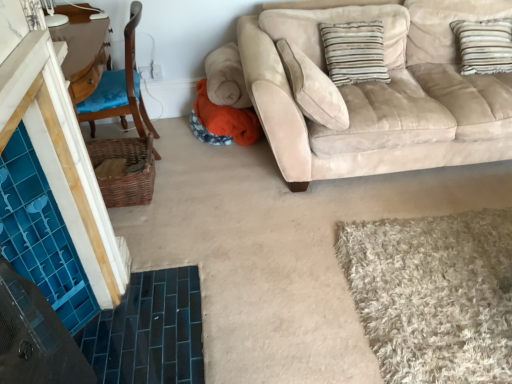
Question: From a real-world perspective, does suede beige couch at upper right stand above striped fabric pillow at upper right?

Choices:
 (A) yes
 (B) no

Answer: (B)

Question: Is suede beige couch at upper right turned away from striped fabric pillow at upper right?

Choices:
 (A) yes
 (B) no

Answer: (A)

Question: Is suede beige couch at upper right in front of striped fabric pillow at upper right?

Choices:
 (A) no
 (B) yes

Answer: (B)

Question: Can you confirm if suede beige couch at upper right is positioned to the right of striped fabric pillow at upper right?

Choices:
 (A) no
 (B) yes

Answer: (B)

Question: Is suede beige couch at upper right taller than striped fabric pillow at upper right?

Choices:
 (A) yes
 (B) no

Answer: (A)

Question: In terms of width, does woven brown basket at left look wider or thinner when compared to blue fabric chair at left?

Choices:
 (A) thin
 (B) wide

Answer: (A)

Question: Does point (115, 142) appear closer or farther from the camera than point (135, 109)?

Choices:
 (A) closer
 (B) farther

Answer: (B)

Question: Visually, is woven brown basket at left positioned to the left or to the right of blue fabric chair at left?

Choices:
 (A) right
 (B) left

Answer: (A)

Question: From the image's perspective, is woven brown basket at left located above or below blue fabric chair at left?

Choices:
 (A) above
 (B) below

Answer: (B)

Question: Based on their positions, is suede beige couch at upper right located to the left or right of blue fabric chair at left?

Choices:
 (A) right
 (B) left

Answer: (A)

Question: Relative to blue fabric chair at left, is suede beige couch at upper right in front or behind?

Choices:
 (A) front
 (B) behind

Answer: (A)

Question: Is suede beige couch at upper right taller or shorter than blue fabric chair at left?

Choices:
 (A) tall
 (B) short

Answer: (B)

Question: In terms of width, does suede beige couch at upper right look wider or thinner when compared to blue fabric chair at left?

Choices:
 (A) thin
 (B) wide

Answer: (B)

Question: Is striped fabric pillow at upper right bigger or smaller than suede beige couch at upper right?

Choices:
 (A) small
 (B) big

Answer: (A)

Question: Does point (375, 52) appear closer or farther from the camera than point (273, 104)?

Choices:
 (A) closer
 (B) farther

Answer: (B)